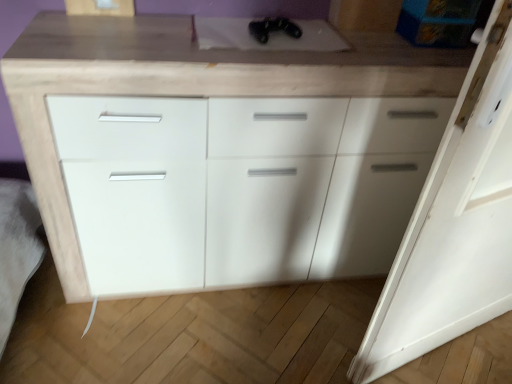
Question: Is white matte door at right facing away from white matte cabinet at center?

Choices:
 (A) no
 (B) yes

Answer: (B)

Question: Does white matte door at right have a greater width compared to white matte cabinet at center?

Choices:
 (A) yes
 (B) no

Answer: (B)

Question: Considering the relative sizes of white matte door at right and white matte cabinet at center in the image provided, is white matte door at right shorter than white matte cabinet at center?

Choices:
 (A) yes
 (B) no

Answer: (B)

Question: From the image's perspective, is white matte door at right beneath white matte cabinet at center?

Choices:
 (A) no
 (B) yes

Answer: (B)

Question: Is white matte door at right not close to white matte cabinet at center?

Choices:
 (A) yes
 (B) no

Answer: (B)

Question: Looking at their shapes, would you say black matte controller at upper center is wider or thinner than white matte door at right?

Choices:
 (A) thin
 (B) wide

Answer: (B)

Question: Which is correct: black matte controller at upper center is inside white matte door at right, or outside of it?

Choices:
 (A) outside
 (B) inside

Answer: (A)

Question: Considering the positions of black matte controller at upper center and white matte door at right in the image, is black matte controller at upper center bigger or smaller than white matte door at right?

Choices:
 (A) big
 (B) small

Answer: (B)

Question: From a real-world perspective, is black matte controller at upper center above or below white matte door at right?

Choices:
 (A) below
 (B) above

Answer: (B)

Question: Is white matte cabinet at center to the left or to the right of black matte controller at upper center in the image?

Choices:
 (A) right
 (B) left

Answer: (B)

Question: Is white matte cabinet at center inside or outside of black matte controller at upper center?

Choices:
 (A) inside
 (B) outside

Answer: (B)

Question: From the image's perspective, is white matte cabinet at center above or below black matte controller at upper center?

Choices:
 (A) below
 (B) above

Answer: (A)

Question: Considering their positions, is white matte cabinet at center located in front of or behind black matte controller at upper center?

Choices:
 (A) front
 (B) behind

Answer: (A)

Question: From their relative heights in the image, would you say black matte controller at upper center is taller or shorter than white matte cabinet at center?

Choices:
 (A) tall
 (B) short

Answer: (B)

Question: From a real-world perspective, is black matte controller at upper center physically located above or below white matte cabinet at center?

Choices:
 (A) below
 (B) above

Answer: (B)